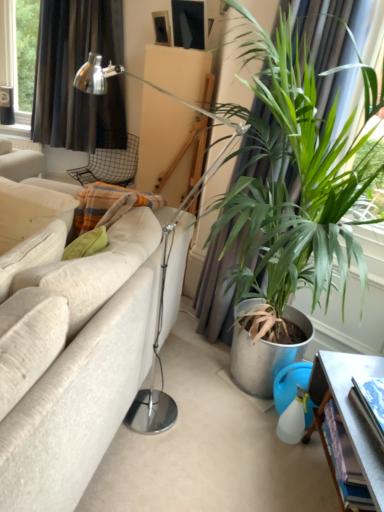
Question: Is black fabric curtain at upper left not inside matte black picture frame at upper center?

Choices:
 (A) yes
 (B) no

Answer: (A)

Question: From a real-world perspective, does black fabric curtain at upper left sit lower than matte black picture frame at upper center?

Choices:
 (A) yes
 (B) no

Answer: (A)

Question: Could matte black picture frame at upper center be considered to be inside black fabric curtain at upper left?

Choices:
 (A) no
 (B) yes

Answer: (A)

Question: Considering the relative sizes of black fabric curtain at upper left and matte black picture frame at upper center in the image provided, is black fabric curtain at upper left taller than matte black picture frame at upper center?

Choices:
 (A) no
 (B) yes

Answer: (B)

Question: Considering the relative sizes of black fabric curtain at upper left and matte black picture frame at upper center in the image provided, is black fabric curtain at upper left smaller than matte black picture frame at upper center?

Choices:
 (A) no
 (B) yes

Answer: (A)

Question: Is metallic gray table at lower right in front of or behind metal mesh chair at upper center in the image?

Choices:
 (A) behind
 (B) front

Answer: (B)

Question: Considering the positions of point (377, 486) and point (96, 150), is point (377, 486) closer or farther from the camera than point (96, 150)?

Choices:
 (A) farther
 (B) closer

Answer: (B)

Question: Is metallic gray table at lower right wider or thinner than metal mesh chair at upper center?

Choices:
 (A) wide
 (B) thin

Answer: (B)

Question: Is metallic gray table at lower right bigger or smaller than metal mesh chair at upper center?

Choices:
 (A) big
 (B) small

Answer: (B)

Question: Looking at the image, does metallic gray table at lower right seem bigger or smaller compared to green leafy plant at right?

Choices:
 (A) big
 (B) small

Answer: (B)

Question: Is point (349, 414) positioned closer to the camera than point (297, 75)?

Choices:
 (A) closer
 (B) farther

Answer: (B)

Question: Considering their positions, is metallic gray table at lower right located in front of or behind green leafy plant at right?

Choices:
 (A) front
 (B) behind

Answer: (A)

Question: Is metallic gray table at lower right spatially inside green leafy plant at right, or outside of it?

Choices:
 (A) inside
 (B) outside

Answer: (B)

Question: Do you think metal mesh chair at upper center is within black fabric curtain at upper left, or outside of it?

Choices:
 (A) inside
 (B) outside

Answer: (B)

Question: Considering the positions of metal mesh chair at upper center and black fabric curtain at upper left in the image, is metal mesh chair at upper center taller or shorter than black fabric curtain at upper left?

Choices:
 (A) short
 (B) tall

Answer: (A)